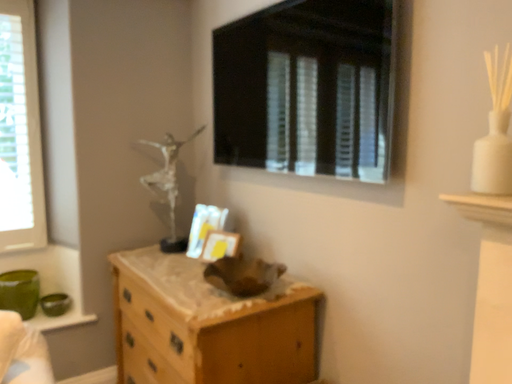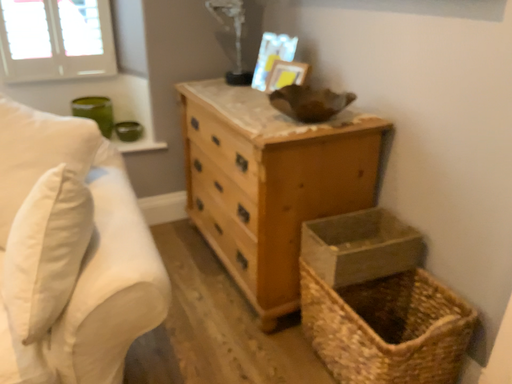
Question: Which way did the camera rotate in the video?

Choices:
 (A) rotated downward
 (B) rotated upward

Answer: (A)